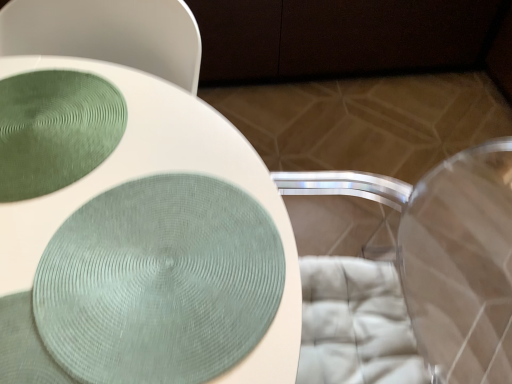
Question: Considering the relative positions of matte green fabric at center and transparent plastic swivel chair at lower right in the image provided, is matte green fabric at center to the left of transparent plastic swivel chair at lower right from the viewer's perspective?

Choices:
 (A) yes
 (B) no

Answer: (A)

Question: Considering the relative sizes of matte green fabric at center and transparent plastic swivel chair at lower right in the image provided, is matte green fabric at center bigger than transparent plastic swivel chair at lower right?

Choices:
 (A) yes
 (B) no

Answer: (A)

Question: From the image's perspective, is matte green fabric at center above transparent plastic swivel chair at lower right?

Choices:
 (A) yes
 (B) no

Answer: (A)

Question: Is matte green fabric at center placed right next to transparent plastic swivel chair at lower right?

Choices:
 (A) yes
 (B) no

Answer: (B)

Question: From the image's perspective, does matte green fabric at center appear lower than transparent plastic swivel chair at lower right?

Choices:
 (A) no
 (B) yes

Answer: (A)

Question: Looking at their shapes, would you say matte green fabric at center is wider or thinner than green textured glass plate at upper left?

Choices:
 (A) thin
 (B) wide

Answer: (B)

Question: Is matte green fabric at center in front of or behind green textured glass plate at upper left in the image?

Choices:
 (A) front
 (B) behind

Answer: (A)

Question: In the image, is matte green fabric at center on the left side or the right side of green textured glass plate at upper left?

Choices:
 (A) right
 (B) left

Answer: (A)

Question: From a real-world perspective, is matte green fabric at center physically located above or below green textured glass plate at upper left?

Choices:
 (A) below
 (B) above

Answer: (A)

Question: In terms of width, does transparent plastic swivel chair at lower right look wider or thinner when compared to matte green fabric at center?

Choices:
 (A) wide
 (B) thin

Answer: (B)

Question: Is transparent plastic swivel chair at lower right taller or shorter than matte green fabric at center?

Choices:
 (A) short
 (B) tall

Answer: (B)

Question: In the image, is transparent plastic swivel chair at lower right positioned in front of or behind matte green fabric at center?

Choices:
 (A) front
 (B) behind

Answer: (A)

Question: Based on their positions, is transparent plastic swivel chair at lower right located to the left or right of matte green fabric at center?

Choices:
 (A) right
 (B) left

Answer: (A)

Question: Considering the positions of matte green fabric at center and transparent plastic swivel chair at lower right in the image, is matte green fabric at center taller or shorter than transparent plastic swivel chair at lower right?

Choices:
 (A) tall
 (B) short

Answer: (B)

Question: In terms of width, does matte green fabric at center look wider or thinner when compared to transparent plastic swivel chair at lower right?

Choices:
 (A) wide
 (B) thin

Answer: (A)